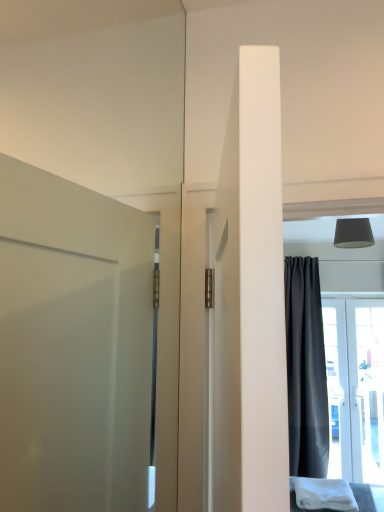
Question: Is white soft cloth at lower right taller or shorter than dark gray matte curtain at right?

Choices:
 (A) short
 (B) tall

Answer: (A)

Question: From the image's perspective, relative to dark gray matte curtain at right, is white soft cloth at lower right above or below?

Choices:
 (A) below
 (B) above

Answer: (A)

Question: Estimate the real-world distances between objects in this image. Which object is farther from the matte gray lampshade at upper right?

Choices:
 (A) dark gray matte curtain at right
 (B) white glossy door at right
 (C) white soft cloth at lower right

Answer: (B)

Question: Which object is the farthest from the white soft cloth at lower right?

Choices:
 (A) dark gray matte curtain at right
 (B) white glossy door at right
 (C) matte gray lampshade at upper right

Answer: (C)